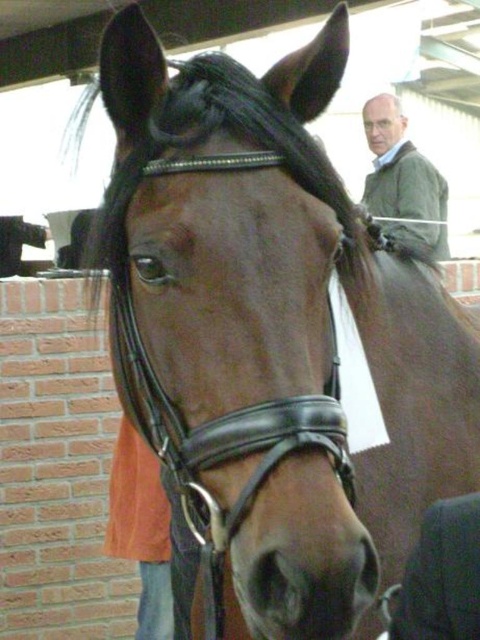
You are a photographer positioned in front of the horse. You notice the green matte jacket at upper right and the white hair at upper center in your viewfinder. Which object is nearer to your camera lens?

The green matte jacket at upper right is closer to the viewer than the white hair at upper center, so the green matte jacket at upper right is nearer to your camera lens.

Based on the scene description, can you determine if the green matte jacket at upper right is wider than the white hair at upper center?

The Objects Description states that the green matte jacket at upper right might be wider than white hair at upper center, so it is possible that the green matte jacket at upper right is wider than the white hair at upper center.

You are a photographer standing in front of the horse. You want to take a photo of the white hair at upper center but need to ensure the green matte jacket at upper right won

→ The distance between the green matte jacket at upper right and the white hair at upper center is 11.97 inches. To avoid the jacket appearing in the photo, you should position yourself or adjust your angle so the jacket is not within the frame of the white hair at upper center.